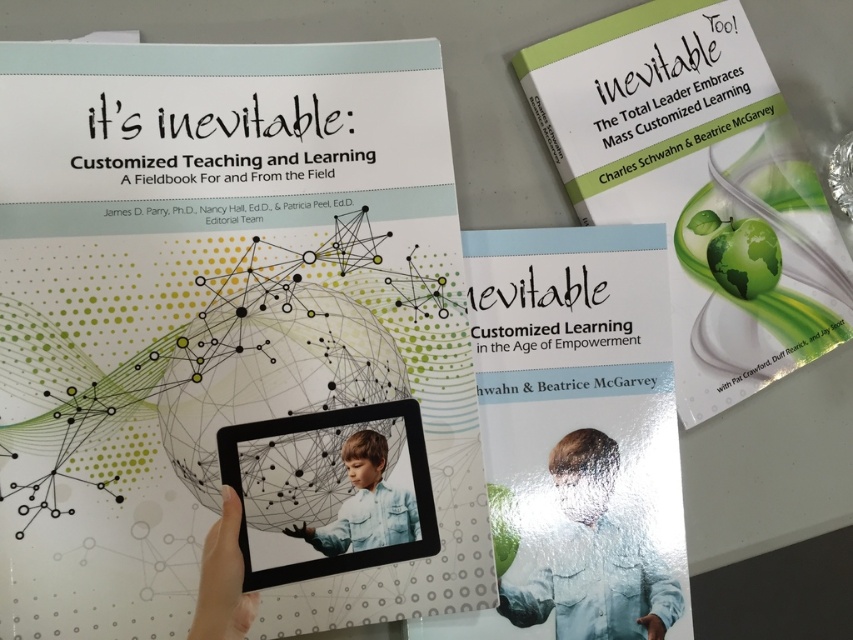
Question: Which point is farther from the camera taking this photo?

Choices:
 (A) (289, 500)
 (B) (312, 532)
 (C) (659, 637)
 (D) (248, 248)

Answer: (C)

Question: Can you confirm if black matte tablet at center is positioned to the left of gray matte hand at lower right?

Choices:
 (A) yes
 (B) no

Answer: (A)

Question: Is light blue denim shirt at center below gray matte hand at lower right?

Choices:
 (A) no
 (B) yes

Answer: (A)

Question: Which object appears farthest from the camera in this image?

Choices:
 (A) black matte hand at center
 (B) green matte book at upper right
 (C) black matte tablet at center
 (D) translucent plastic boy at center

Answer: (B)

Question: Is matte green book at center to the right of black matte hand at center from the viewer's perspective?

Choices:
 (A) yes
 (B) no

Answer: (A)

Question: Which object appears farthest from the camera in this image?

Choices:
 (A) translucent plastic boy at center
 (B) black matte tablet at center
 (C) green matte book at upper right
 (D) matte green book at center

Answer: (C)